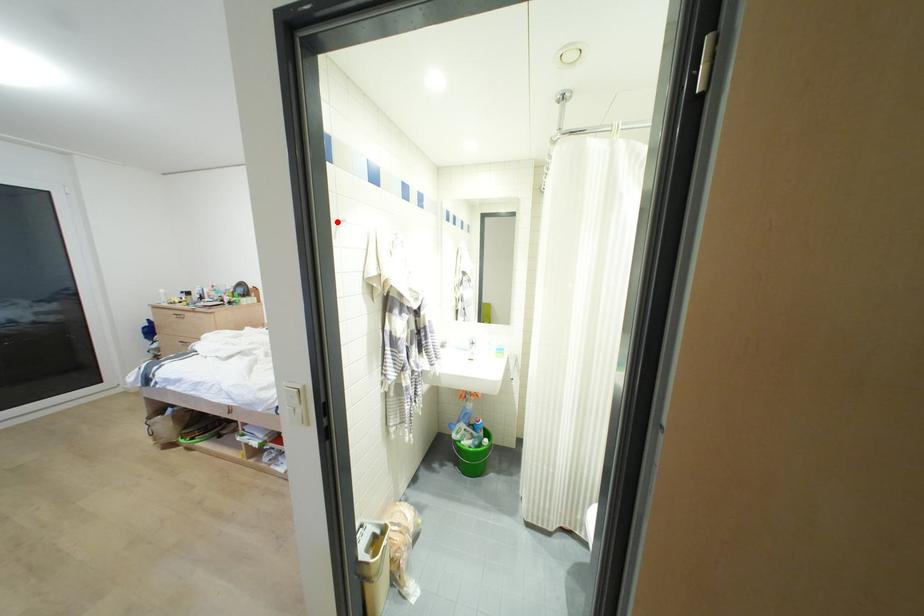
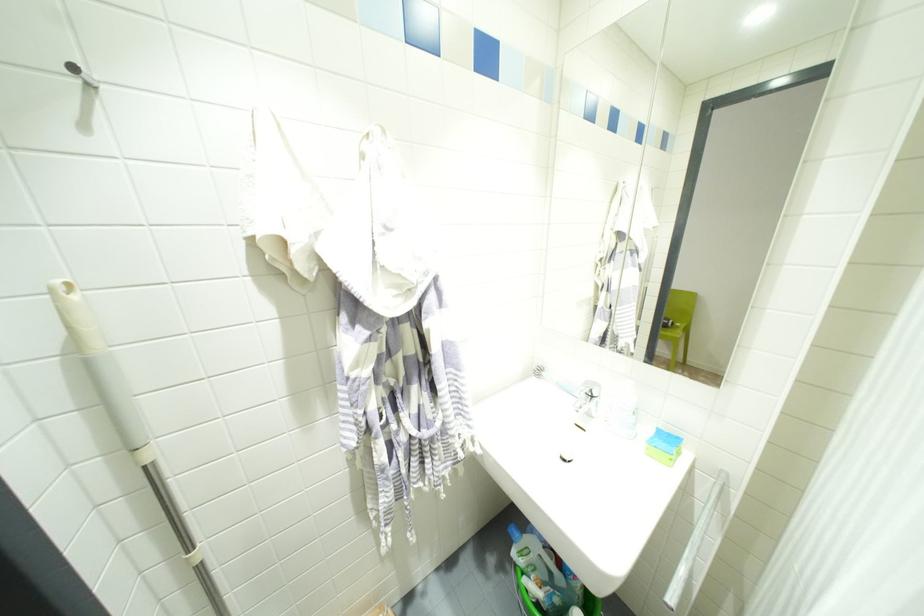
Find the pixel in the second image that matches the highlighted location in the first image.

(91, 84)